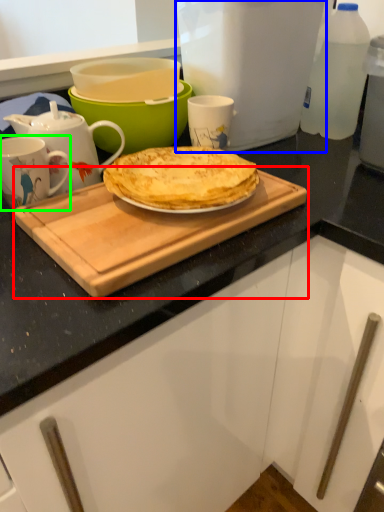
Question: Which object is the farthest from cutting board (highlighted by a red box)? Choose among these: kitchen appliance (highlighted by a blue box) or coffee cup (highlighted by a green box).

Choices:
 (A) kitchen appliance
 (B) coffee cup

Answer: (A)